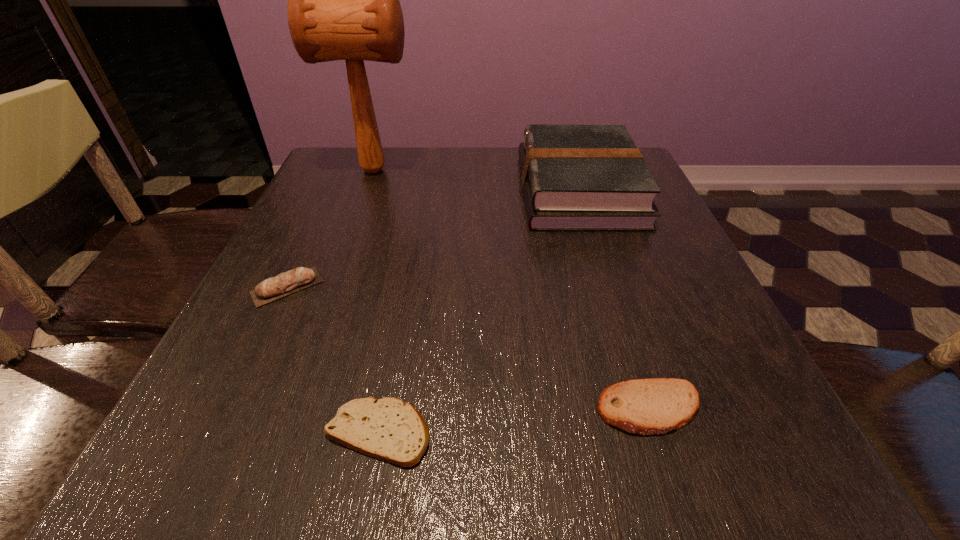
I want to click on the tallest object, so click(343, 0).

Locate an element on the screen. hardback book is located at coordinates (575, 177).

At what (x,y) coordinates should I click in order to perform the action: click on the leftmost pita bread. Please return your answer as a coordinate pair (x, y). The image size is (960, 540). Looking at the image, I should click on (299, 278).

I want to click on the farthest pita bread, so click(299, 278).

This screenshot has width=960, height=540. I want to click on the second shortest object, so click(653, 406).

Locate an element on the screen. Image resolution: width=960 pixels, height=540 pixels. the second tallest pita bread is located at coordinates (653, 406).

The image size is (960, 540). Find the location of `the second pita bread from right to left`. the second pita bread from right to left is located at coordinates (389, 429).

You are a GUI agent. You are given a task and a screenshot of the screen. Output one action in this format:
    pyautogui.click(x=<x>, y=<y>)
    Task: Click on the shortest pita bread
    The image size is (960, 540).
    Given the screenshot: What is the action you would take?
    pyautogui.click(x=389, y=429)

This screenshot has width=960, height=540. What are the coordinates of `vacant point located on the strike surface of the mallet` in the screenshot? It's located at (521, 170).

Identify the location of vacant space located 0.100m on the spine side of the fourth shortest object. (479, 190).